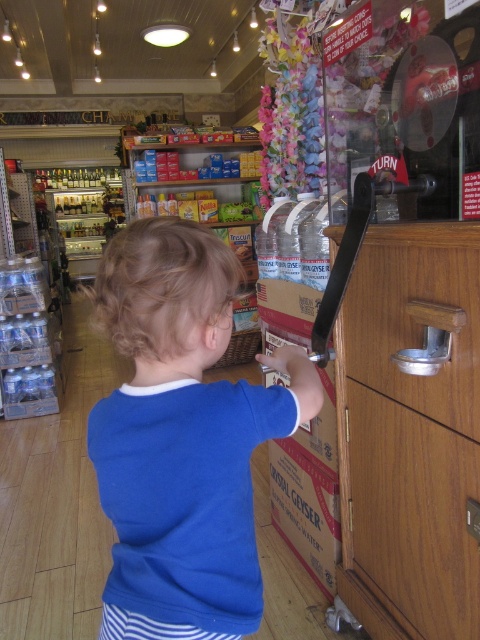
You are a customer in the store and want to reach the wooden drawer at center to get a form. However, there is a blue cotton shirt at center in your way. Can you move around the shirt to access the drawer?

The blue cotton shirt at center is to the left of the wooden drawer at center, so you can move around to the right side of the shirt to access the drawer.

You are a delivery person who needs to place a package between the blue cotton shirt at center and the wooden at right. The package is 16 inches long. Can you fit it between them without moving either object?

The distance between the blue cotton shirt at center and the wooden at right is 17.03 inches. Since the package is 16 inches long, it can fit between them as there is enough space.

You are a parent trying to buy a toy for your child. You see the blue cotton shirt at center and the wooden at right. Which item is taller and would require more vertical space to display?

The blue cotton shirt at center is much taller than the wooden at right, so it would require more vertical space to display.